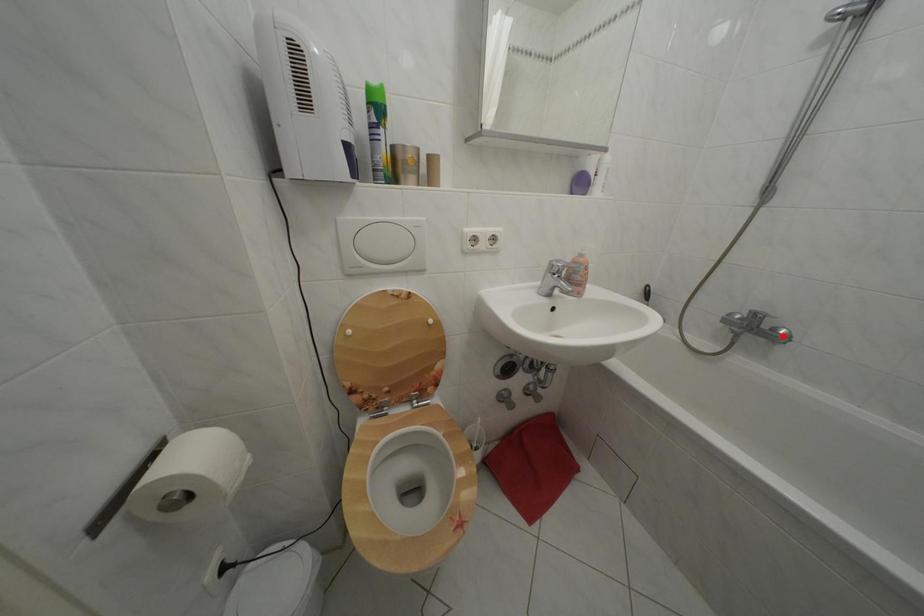
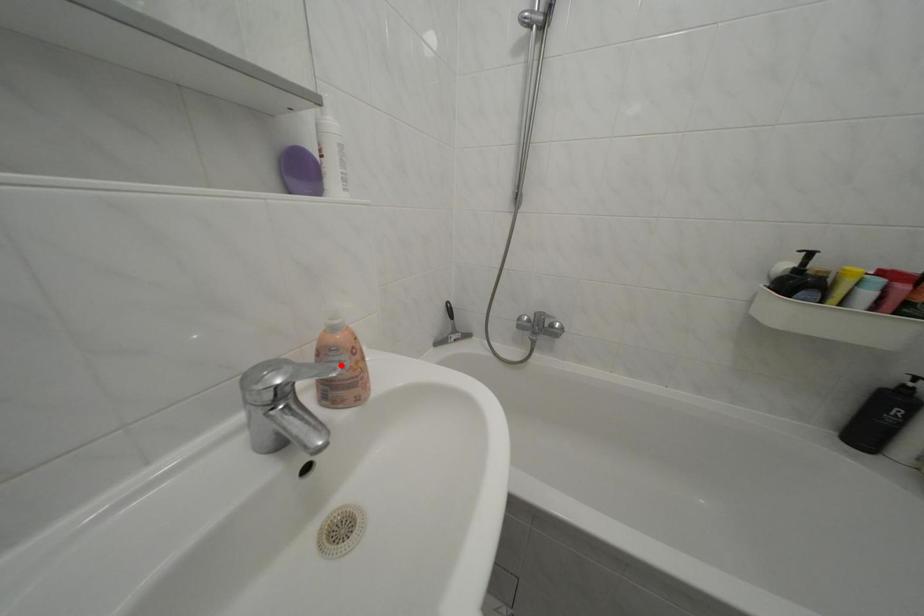
I am providing you with two images of the same scene from different viewpoints. A red point is marked on the first image and another point is marked on the second image. Is the marked point in image1 the same physical position as the marked point in image2?

No